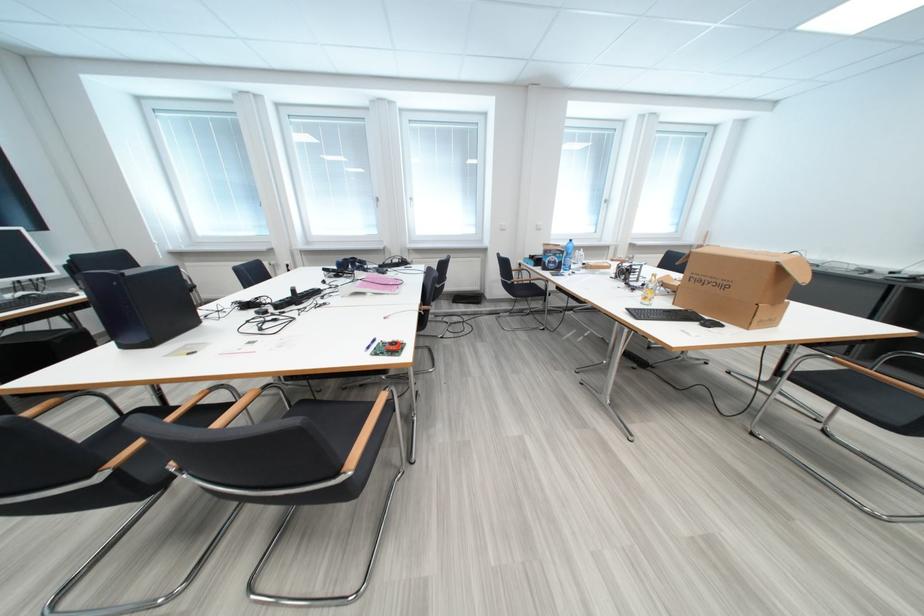
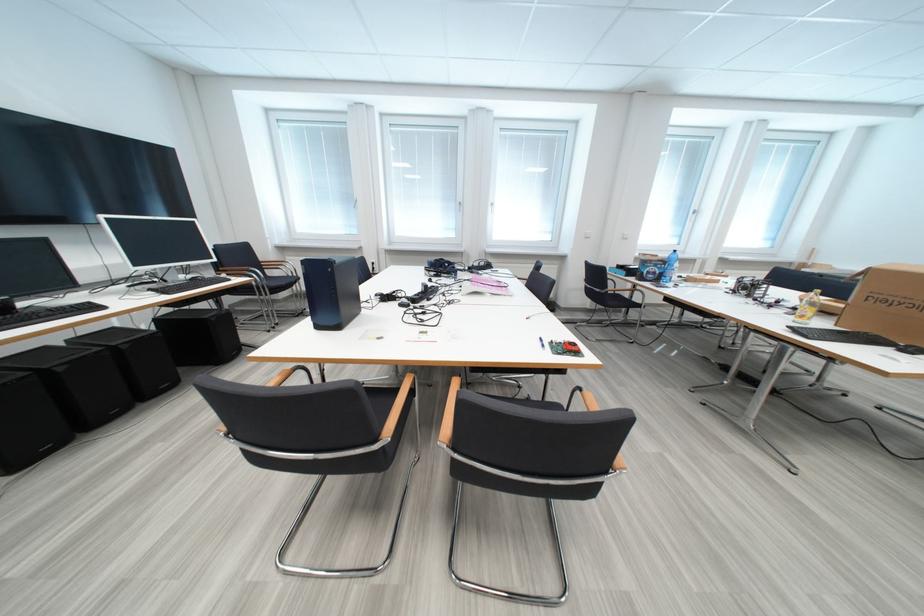
Locate, in the second image, the point that corresponds to (573,254) in the first image.

(675, 265)